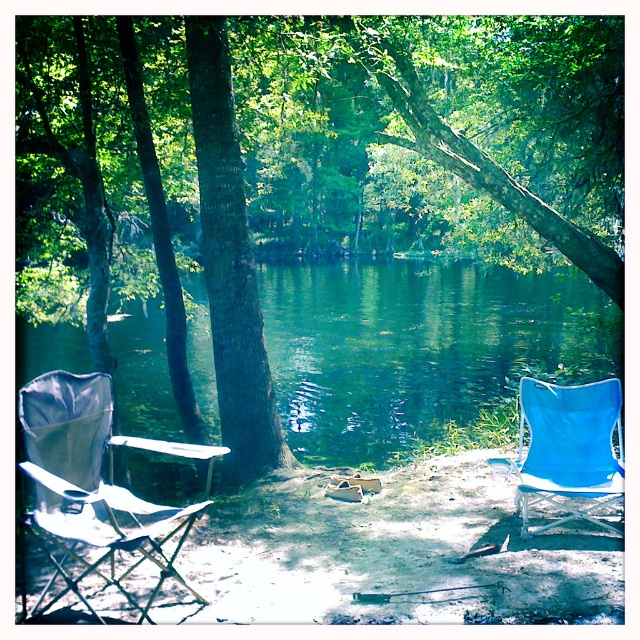
Can you confirm if silver metallic beach chair at left is positioned to the right of blue fabric chair at right?

No, silver metallic beach chair at left is not to the right of blue fabric chair at right.

Between point (58, 541) and point (604, 444), which one is positioned behind?

The point (604, 444) is behind.

Locate an element on the screen. The image size is (640, 640). silver metallic beach chair at left is located at coordinates (93, 483).

Identify the location of green rough bark tree at center. (228, 264).

Is the position of green rough bark tree at center less distant than that of silver metallic beach chair at left?

No, it is behind silver metallic beach chair at left.

Between point (230, 355) and point (154, 554), which one is positioned in front?

Point (154, 554)

Find the location of a particular element. green rough bark tree at center is located at coordinates (228, 264).

Is point (516, 116) less distant than point (570, 464)?

No, it is not.

Consider the image. Is green textured tree trunk at center bigger than blue fabric chair at right?

Yes.

Is point (168, 125) in front of point (611, 500)?

That is False.

The width and height of the screenshot is (640, 640). In order to click on green textured tree trunk at center in this screenshot , I will do `click(385, 152)`.